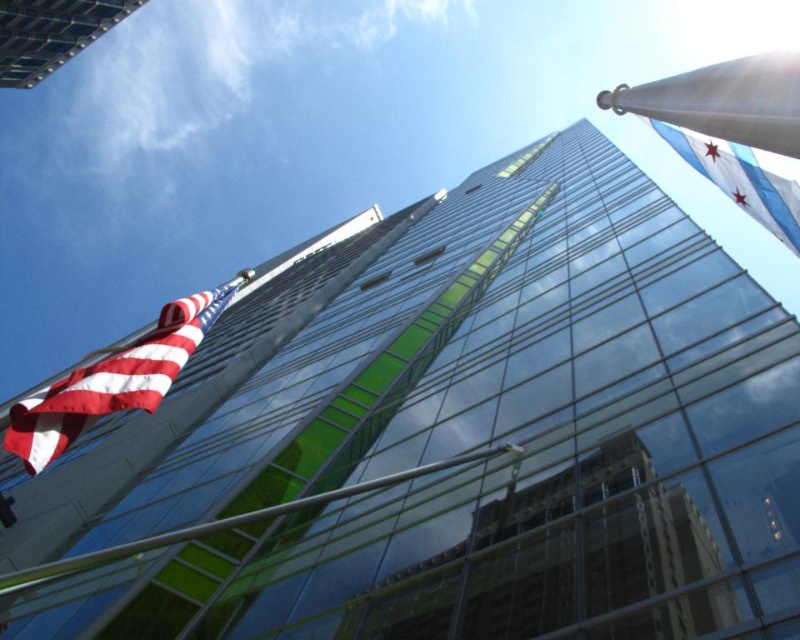
Between white metallic flagpole at upper right and blue and white striped flag at upper right, which one has more height?

With more height is white metallic flagpole at upper right.

Does white metallic flagpole at upper right have a larger size compared to blue and white striped flag at upper right?

Yes, white metallic flagpole at upper right is bigger than blue and white striped flag at upper right.

Does point (740, 106) come behind point (686, 156)?

No, it is in front of (686, 156).

Find the location of a particular element. The width and height of the screenshot is (800, 640). white metallic flagpole at upper right is located at coordinates (724, 100).

Between red-white-striped fabric flag at left and blue and white striped flag at upper right, which one appears on the right side from the viewer's perspective?

blue and white striped flag at upper right is more to the right.

Does red-white-striped fabric flag at left appear on the right side of blue and white striped flag at upper right?

Incorrect, red-white-striped fabric flag at left is not on the right side of blue and white striped flag at upper right.

Is point (154, 355) behind point (778, 228)?

Yes, point (154, 355) is behind point (778, 228).

Locate an element on the screen. The height and width of the screenshot is (640, 800). red-white-striped fabric flag at left is located at coordinates (114, 380).

Does red-white-striped fabric flag at left have a lesser width compared to white metallic flagpole at upper right?

Incorrect, red-white-striped fabric flag at left's width is not less than white metallic flagpole at upper right's.

Which is behind, point (84, 390) or point (702, 112)?

The point (84, 390) is more distant.

Where is `red-white-striped fabric flag at left`? red-white-striped fabric flag at left is located at coordinates (114, 380).

Where is `red-white-striped fabric flag at left`? red-white-striped fabric flag at left is located at coordinates (114, 380).